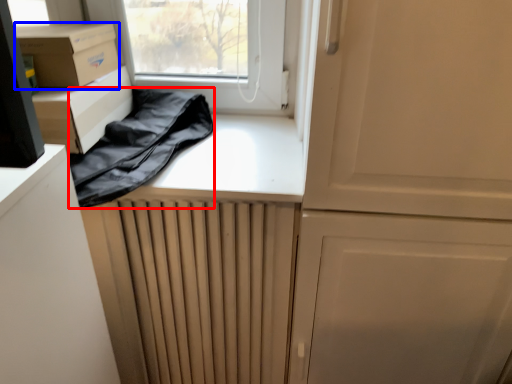
Question: Which of the following is the closest to the observer, clothing (highlighted by a red box) or cardboard box (highlighted by a blue box)?

Choices:
 (A) clothing
 (B) cardboard box

Answer: (A)